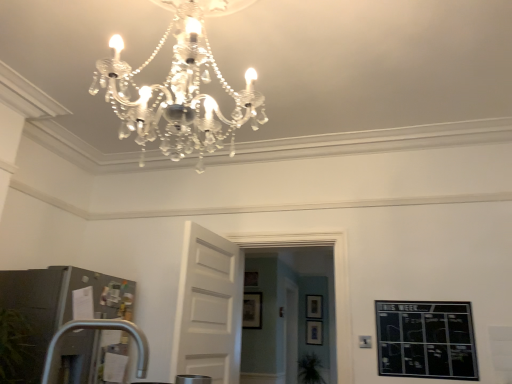
Question: From their relative heights in the image, would you say matte black picture frame at center, marked as the third picture frame in a front-to-back arrangement, is taller or shorter than white wooden door at center?

Choices:
 (A) short
 (B) tall

Answer: (A)

Question: Do you think matte black picture frame at center, the 2th picture frame in the back-to-front sequence, is within white wooden door at center, or outside of it?

Choices:
 (A) inside
 (B) outside

Answer: (B)

Question: Estimate the real-world distances between objects in this image. Which object is closer to the green leafy plant at lower center?

Choices:
 (A) matte black picture frame at center, the first picture frame when ordered from bottom to top
 (B) matte black picture frame at center, which is counted as the 1th picture frame, starting from the front
 (C) transparent glass door at center
 (D) wooden picture frame at center, the 1th picture frame viewed from the back
 (E) wooden picture frame at center, which appears as the 3th picture frame when viewed from the back

Answer: (A)

Question: Based on their relative distances, which object is nearer to the wooden picture frame at center, marked as the 4th picture frame in a bottom-to-top arrangement?

Choices:
 (A) green leafy plant at lower center
 (B) matte black picture frame at center, the 3th picture frame when ordered from left to right
 (C) white wooden door at center
 (D) wooden picture frame at center, the 4th picture frame viewed from the left
 (E) transparent glass door at center

Answer: (E)